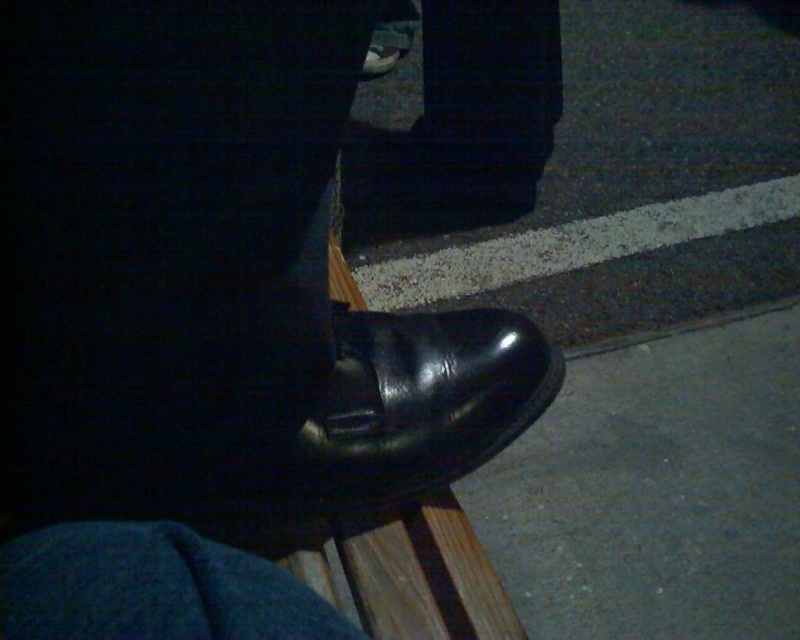
You are a photographer setting up a shoot in a dimly lit area. You have two shoes in the scene, a shiny black shoe at center and a black rubber shoe at lower right. Which shoe should you focus on if you want to capture the widest part of the shoes?

The black rubber shoe at lower right has a greater width than the shiny black shoe at center, so focusing on it will allow you to capture the widest part of the shoes.

You are a delivery robot that needs to place a package between the shiny black shoe at center and the black rubber shoe at lower right. The package is 18 inches long. Can you fit it between them?

The shiny black shoe at center is 20.82 inches from the black rubber shoe at lower right, so yes, the package can fit between them as the distance is greater than the package length.

You are a fashion designer analyzing footwear in a photo. You notice two shoes labeled as shiny black shoe at center and black leather shoe at center. Which one has a higher height?

The shiny black shoe at center is much taller than the black leather shoe at center.